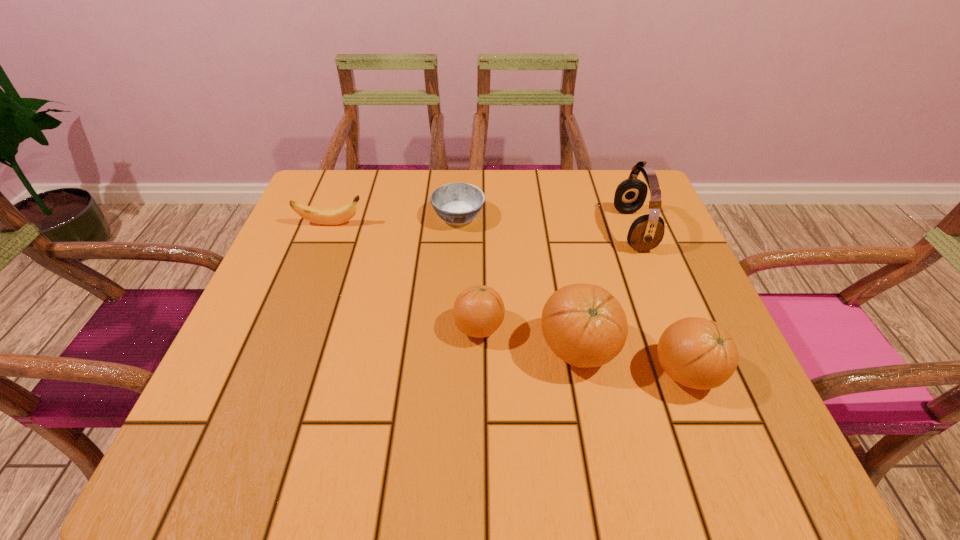
The width and height of the screenshot is (960, 540). In the image, there is a desktop. Find the location of `vacant region at the far right corner`. vacant region at the far right corner is located at coordinates (605, 187).

Where is `free area in between the fourth object from left to right and the leftmost orange`? free area in between the fourth object from left to right and the leftmost orange is located at coordinates (528, 338).

Where is `vacant area between the rightmost orange and the banana`? The height and width of the screenshot is (540, 960). vacant area between the rightmost orange and the banana is located at coordinates (508, 299).

Where is `vacant area that lies between the second shortest object and the headset`? Image resolution: width=960 pixels, height=540 pixels. vacant area that lies between the second shortest object and the headset is located at coordinates (482, 227).

Identify the location of vacant point located between the fourth object from left to right and the headset. (606, 289).

The height and width of the screenshot is (540, 960). What are the coordinates of `free space between the leftmost orange and the ashtray` in the screenshot? It's located at (468, 272).

You are a GUI agent. You are given a task and a screenshot of the screen. Output one action in this format:
    pyautogui.click(x=<x>, y=<y>)
    Task: Click on the empty space that is in between the fourth shortest object and the headset
    The image size is (960, 540).
    Given the screenshot: What is the action you would take?
    pyautogui.click(x=660, y=301)

At what (x,y) coordinates should I click in order to perform the action: click on vacant area that lies between the headset and the shortest orange. Please return your answer as a coordinate pair (x, y). The height and width of the screenshot is (540, 960). Looking at the image, I should click on (556, 279).

I want to click on vacant space that's between the ashtray and the shortest orange, so click(468, 272).

Find the location of a particular element. Image resolution: width=960 pixels, height=540 pixels. free spot between the rightmost orange and the headset is located at coordinates (660, 301).